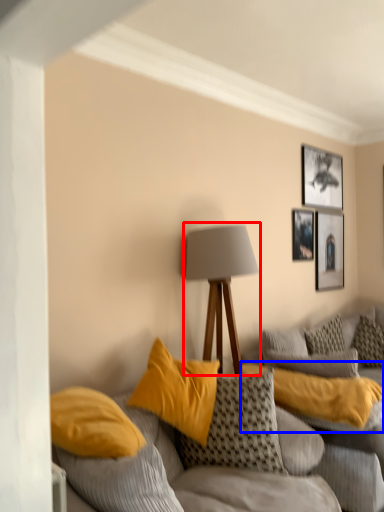
Question: Which object appears farthest to the camera in this image, lamp (highlighted by a red box) or pillow (highlighted by a blue box)?

Choices:
 (A) lamp
 (B) pillow

Answer: (A)